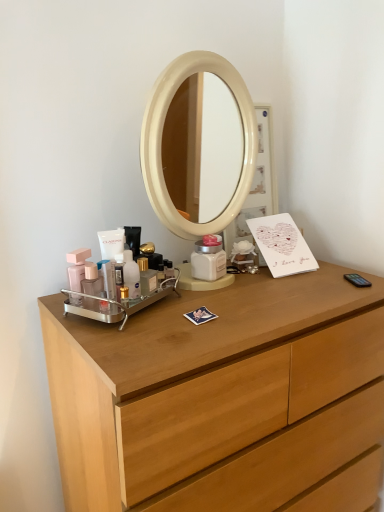
The width and height of the screenshot is (384, 512). Identify the location of matte pink plastic at left, marked as the fourth toiletry in a right-to-left arrangement. (77, 272).

This screenshot has width=384, height=512. I want to click on translucent plastic bottle at center, the 1th toiletry when ordered from right to left, so click(131, 274).

This screenshot has width=384, height=512. I want to click on translucent plastic tube at center, which is counted as the third toiletry, starting from the left, so click(x=119, y=275).

Looking at this image, from a real-world perspective, which object stands above the other?

translucent plastic tube at center, the second toiletry viewed from the right, is physically above.

Which of these two, translucent plastic bottle at center, placed as the fourth toiletry when sorted from left to right, or translucent plastic tube at center, which is counted as the third toiletry, starting from the left, is wider?

With larger width is translucent plastic bottle at center, placed as the fourth toiletry when sorted from left to right.

Which of these two, translucent plastic bottle at center, the 1th toiletry when ordered from right to left, or translucent plastic tube at center, the second toiletry viewed from the right, is smaller?

Smaller between the two is translucent plastic tube at center, the second toiletry viewed from the right.

Based on the photo, would you say matte pink plastic at left, marked as the fourth toiletry in a right-to-left arrangement, is outside light wood chest of drawers at center?

Yes, matte pink plastic at left, marked as the fourth toiletry in a right-to-left arrangement, is outside of light wood chest of drawers at center.

From the image's perspective, is matte pink plastic at left, arranged as the first toiletry when viewed from the left, above light wood chest of drawers at center?

Indeed, from the image's perspective, matte pink plastic at left, arranged as the first toiletry when viewed from the left, is shown above light wood chest of drawers at center.

Would you consider matte pink plastic at left, arranged as the first toiletry when viewed from the left, to be distant from light wood chest of drawers at center?

They are positioned close to each other.

Considering the sizes of objects matte pink plastic at left, marked as the fourth toiletry in a right-to-left arrangement, and light wood chest of drawers at center in the image provided, who is taller, matte pink plastic at left, marked as the fourth toiletry in a right-to-left arrangement, or light wood chest of drawers at center?

light wood chest of drawers at center.

Does light wood chest of drawers at center appear on the right side of translucent plastic bottle at center, the 1th toiletry when ordered from right to left?

Indeed, light wood chest of drawers at center is positioned on the right side of translucent plastic bottle at center, the 1th toiletry when ordered from right to left.

How much distance is there between light wood chest of drawers at center and translucent plastic bottle at center, the 1th toiletry when ordered from right to left?

A distance of 14.98 inches exists between light wood chest of drawers at center and translucent plastic bottle at center, the 1th toiletry when ordered from right to left.

Is light wood chest of drawers at center bigger than translucent plastic bottle at center, the 1th toiletry when ordered from right to left?

Correct, light wood chest of drawers at center is larger in size than translucent plastic bottle at center, the 1th toiletry when ordered from right to left.

Is light wood chest of drawers at center spatially inside translucent plastic bottle at center, placed as the fourth toiletry when sorted from left to right, or outside of it?

light wood chest of drawers at center lies outside translucent plastic bottle at center, placed as the fourth toiletry when sorted from left to right.

Is translucent plastic tube at center, which is counted as the third toiletry, starting from the left, behind light wood chest of drawers at center?

That is True.

Is translucent plastic tube at center, the second toiletry viewed from the right, inside or outside of light wood chest of drawers at center?

translucent plastic tube at center, the second toiletry viewed from the right, is spatially situated outside light wood chest of drawers at center.

Is translucent plastic tube at center, which is counted as the third toiletry, starting from the left, touching light wood chest of drawers at center?

There is a gap between translucent plastic tube at center, which is counted as the third toiletry, starting from the left, and light wood chest of drawers at center.

Is point (122, 267) closer to viewer compared to point (116, 386)?

No, it is behind (116, 386).

Is light wood chest of drawers at center bigger or smaller than matte pink bottle at left, the 3th toiletry in the right-to-left sequence?

Clearly, light wood chest of drawers at center is larger in size than matte pink bottle at left, the 3th toiletry in the right-to-left sequence.

Does light wood chest of drawers at center come behind matte pink bottle at left, the 3th toiletry in the right-to-left sequence?

That is False.

From the image's perspective, would you say light wood chest of drawers at center is shown under matte pink bottle at left, the second toiletry from the left?

Yes.

Is light wood chest of drawers at center facing towards matte pink bottle at left, the 3th toiletry in the right-to-left sequence?

No, light wood chest of drawers at center is not turned towards matte pink bottle at left, the 3th toiletry in the right-to-left sequence.

Considering the points (188, 508) and (72, 255), which point is behind, point (188, 508) or point (72, 255)?

Positioned behind is point (72, 255).

From the picture: Considering the relative sizes of light wood chest of drawers at center and matte pink plastic at left, marked as the fourth toiletry in a right-to-left arrangement, in the image provided, is light wood chest of drawers at center shorter than matte pink plastic at left, marked as the fourth toiletry in a right-to-left arrangement,?

In fact, light wood chest of drawers at center may be taller than matte pink plastic at left, marked as the fourth toiletry in a right-to-left arrangement.

Looking at this image, could you tell me if light wood chest of drawers at center is turned towards matte pink plastic at left, marked as the fourth toiletry in a right-to-left arrangement?

No.

Is light wood chest of drawers at center inside or outside of matte pink plastic at left, marked as the fourth toiletry in a right-to-left arrangement?

light wood chest of drawers at center exists outside the volume of matte pink plastic at left, marked as the fourth toiletry in a right-to-left arrangement.

Does translucent plastic tube at center, which is counted as the third toiletry, starting from the left, have a lesser height compared to matte pink plastic at left, arranged as the first toiletry when viewed from the left?

Correct, translucent plastic tube at center, which is counted as the third toiletry, starting from the left, is not as tall as matte pink plastic at left, arranged as the first toiletry when viewed from the left.

Measure the distance from translucent plastic tube at center, the second toiletry viewed from the right, to matte pink plastic at left, marked as the fourth toiletry in a right-to-left arrangement.

translucent plastic tube at center, the second toiletry viewed from the right, and matte pink plastic at left, marked as the fourth toiletry in a right-to-left arrangement, are 3.97 inches apart.

Is translucent plastic tube at center, which is counted as the third toiletry, starting from the left, aimed at matte pink plastic at left, marked as the fourth toiletry in a right-to-left arrangement?

No.

Between translucent plastic tube at center, the second toiletry viewed from the right, and matte pink plastic at left, marked as the fourth toiletry in a right-to-left arrangement, which one appears on the left side from the viewer's perspective?

From the viewer's perspective, matte pink plastic at left, marked as the fourth toiletry in a right-to-left arrangement, appears more on the left side.

From a real-world perspective, starting from the translucent plastic bottle at center, placed as the fourth toiletry when sorted from left to right, which toiletry is the 1st one vertically above it? Please provide its 2D coordinates.

[(119, 275)]

Locate an element on the screen. This screenshot has width=384, height=512. the chest of drawers in front of the matte pink plastic at left, arranged as the first toiletry when viewed from the left is located at coordinates (218, 394).

Looking at the image, which one is located closer to light wood chest of drawers at center, matte pink bottle at left, the second toiletry from the left, or matte pink plastic at left, marked as the fourth toiletry in a right-to-left arrangement?

matte pink bottle at left, the second toiletry from the left, is positioned closer to the anchor light wood chest of drawers at center.

Based on their spatial positions, is matte pink plastic at left, marked as the fourth toiletry in a right-to-left arrangement, or light wood chest of drawers at center closer to translucent plastic bottle at center, placed as the fourth toiletry when sorted from left to right?

matte pink plastic at left, marked as the fourth toiletry in a right-to-left arrangement, is positioned closer to the anchor translucent plastic bottle at center, placed as the fourth toiletry when sorted from left to right.

Considering their positions, is matte pink bottle at left, the 3th toiletry in the right-to-left sequence, positioned further to translucent plastic bottle at center, the 1th toiletry when ordered from right to left, than matte pink plastic at left, marked as the fourth toiletry in a right-to-left arrangement?

matte pink plastic at left, marked as the fourth toiletry in a right-to-left arrangement, lies further to translucent plastic bottle at center, the 1th toiletry when ordered from right to left, than the other object.

When comparing their distances from matte pink plastic at left, arranged as the first toiletry when viewed from the left, does matte pink bottle at left, the 3th toiletry in the right-to-left sequence, or light wood chest of drawers at center seem closer?

matte pink bottle at left, the 3th toiletry in the right-to-left sequence, is positioned closer to the anchor matte pink plastic at left, arranged as the first toiletry when viewed from the left.

Looking at this image, estimate the real-world distances between objects in this image. Which object is further from light wood chest of drawers at center, translucent plastic tube at center, which is counted as the third toiletry, starting from the left, or matte pink bottle at left, the second toiletry from the left?

matte pink bottle at left, the second toiletry from the left.

When comparing their distances from translucent plastic tube at center, the second toiletry viewed from the right, does translucent plastic bottle at center, placed as the fourth toiletry when sorted from left to right, or light wood chest of drawers at center seem further?

light wood chest of drawers at center lies further to translucent plastic tube at center, the second toiletry viewed from the right, than the other object.

Looking at the image, which one is located closer to light wood chest of drawers at center, translucent plastic bottle at center, the 1th toiletry when ordered from right to left, or translucent plastic tube at center, which is counted as the third toiletry, starting from the left?

Among the two, translucent plastic bottle at center, the 1th toiletry when ordered from right to left, is located nearer to light wood chest of drawers at center.

Considering their positions, is matte pink bottle at left, the 3th toiletry in the right-to-left sequence, positioned further to translucent plastic bottle at center, the 1th toiletry when ordered from right to left, than translucent plastic tube at center, which is counted as the third toiletry, starting from the left?

Based on the image, matte pink bottle at left, the 3th toiletry in the right-to-left sequence, appears to be further to translucent plastic bottle at center, the 1th toiletry when ordered from right to left.

Identify the location of toiletry that lies between matte pink bottle at left, the second toiletry from the left, and light wood chest of drawers at center from top to bottom. This screenshot has height=512, width=384. (119, 275).

This screenshot has height=512, width=384. Identify the location of toiletry between matte pink plastic at left, marked as the fourth toiletry in a right-to-left arrangement, and translucent plastic tube at center, which is counted as the third toiletry, starting from the left, in the horizontal direction. (91, 280).

Find the location of a particular element. The height and width of the screenshot is (512, 384). toiletry between matte pink bottle at left, the second toiletry from the left, and translucent plastic bottle at center, the 1th toiletry when ordered from right to left is located at coordinates (119, 275).